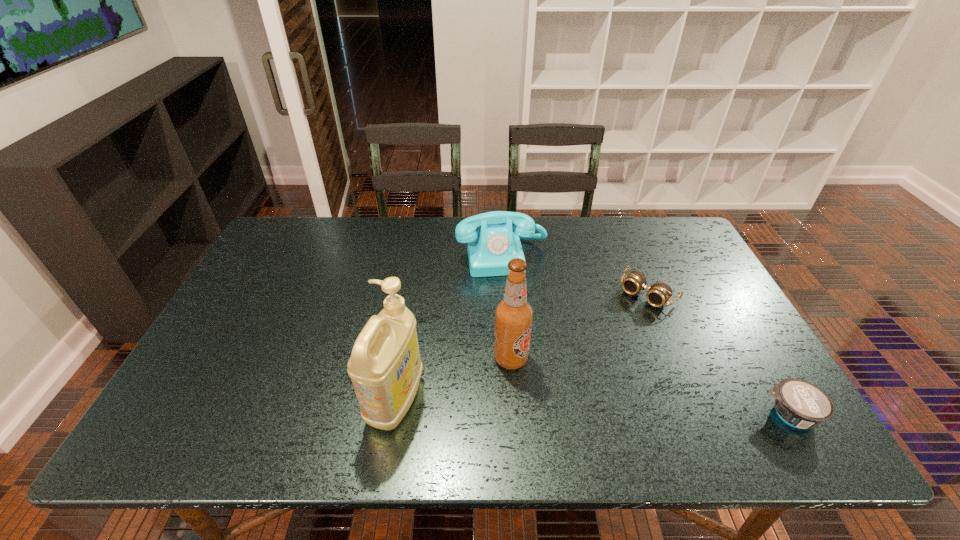
Image resolution: width=960 pixels, height=540 pixels. In order to click on detergent in this screenshot , I will do `click(385, 367)`.

Locate an element on the screen. the rightmost object is located at coordinates (801, 404).

Locate an element on the screen. The width and height of the screenshot is (960, 540). the third shortest object is located at coordinates (490, 249).

This screenshot has height=540, width=960. I want to click on the fourth object from left to right, so click(659, 294).

Where is `beer bottle`? The image size is (960, 540). beer bottle is located at coordinates (513, 314).

I want to click on free spot located on the left of the detergent, so click(199, 401).

This screenshot has width=960, height=540. I want to click on free space located on the back of the rightmost object, so click(713, 287).

Find the location of `vacant space located 0.400m on the dial of the telephone`. vacant space located 0.400m on the dial of the telephone is located at coordinates (531, 389).

At what (x,y) coordinates should I click in order to perform the action: click on vacant space located 0.280m on the dial of the telephone. Please return your answer as a coordinate pair (x, y). The image size is (960, 540). Looking at the image, I should click on click(x=522, y=349).

I want to click on vacant space located 0.330m on the dial of the telephone, so click(x=526, y=366).